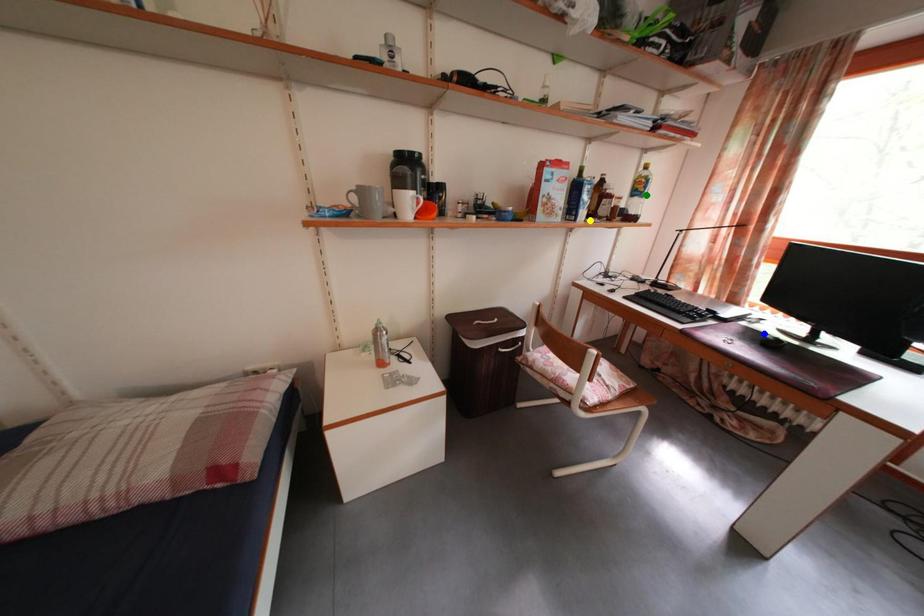
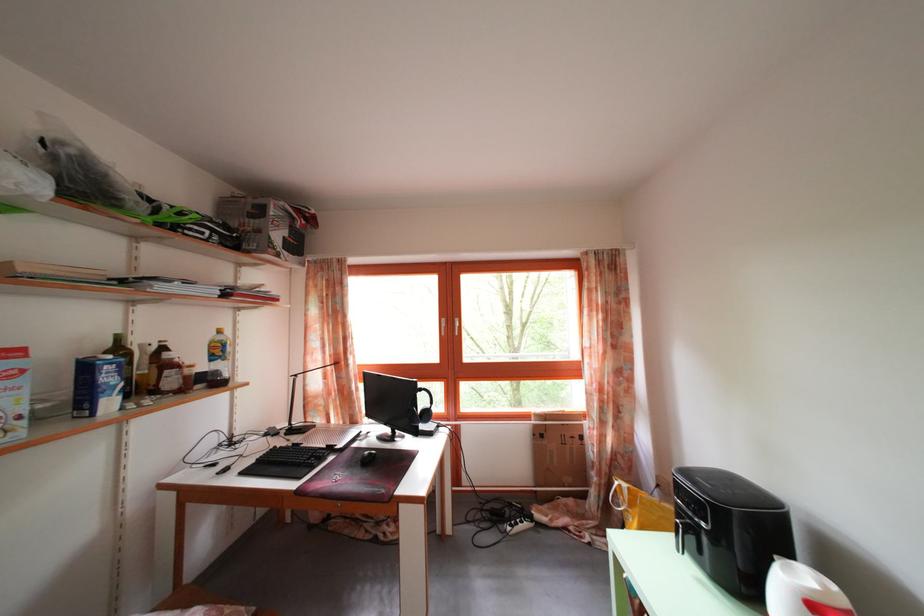
I am providing you with two images of the same scene from different viewpoints. Three points are marked in image1. Which point corresponds to a part or object that is occluded in image2?In image1, three points are marked. Which of them correspond to a part or object that is occluded in image2?Among the three points shown in image1, which one corresponds to a part or object that is no longer visible due to occlusion in image2?

blue point cannot be seen in image2.